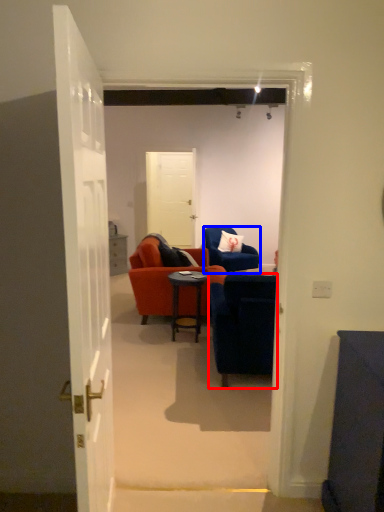
Question: Among these objects, which one is nearest to the camera, chair (highlighted by a red box) or chair (highlighted by a blue box)?

Choices:
 (A) chair
 (B) chair

Answer: (A)